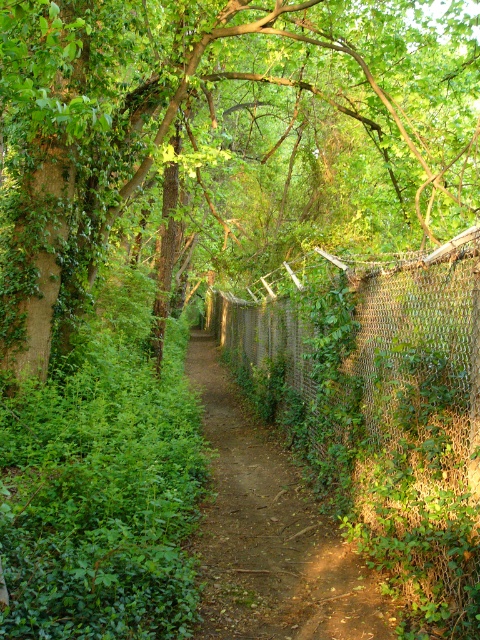
Is point (25, 161) in front of point (377, 320)?

That is False.

Between green leafy tree at center and green chain-link fence at center-right, which one appears on the right side from the viewer's perspective?

Positioned to the right is green chain-link fence at center-right.

Which is behind, point (324, 99) or point (372, 401)?

Positioned behind is point (324, 99).

You are a GUI agent. You are given a task and a screenshot of the screen. Output one action in this format:
    pyautogui.click(x=<x>, y=<y>)
    Task: Click on the green leafy tree at center
    Image resolution: width=480 pixels, height=640 pixels.
    Given the screenshot: What is the action you would take?
    pyautogui.click(x=223, y=140)